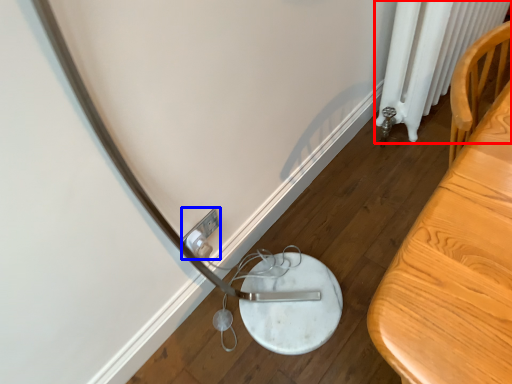
Question: Among these objects, which one is nearest to the camera, radiator (highlighted by a red box) or electric outlet (highlighted by a blue box)?

Choices:
 (A) radiator
 (B) electric outlet

Answer: (B)